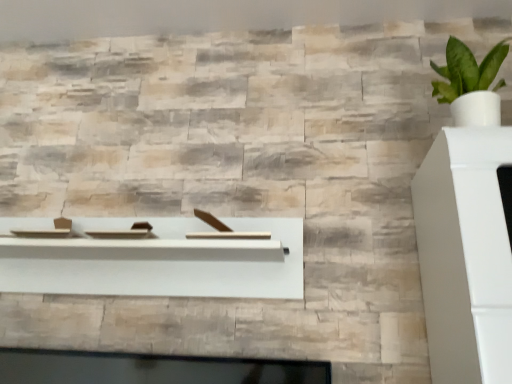
Question: Is green leafy plant in white pot at upper right to the left or to the right of natural stone wall at upper center in the image?

Choices:
 (A) right
 (B) left

Answer: (A)

Question: Is green leafy plant in white pot at upper right taller or shorter than natural stone wall at upper center?

Choices:
 (A) tall
 (B) short

Answer: (A)

Question: Considering the real-world distances, which object is farthest from the white matte wood shelf at center?

Choices:
 (A) green leafy plant in white pot at upper right
 (B) natural stone wall at upper center

Answer: (B)

Question: Which object is the closest to the white matte wood shelf at center?

Choices:
 (A) natural stone wall at upper center
 (B) green leafy plant in white pot at upper right

Answer: (B)